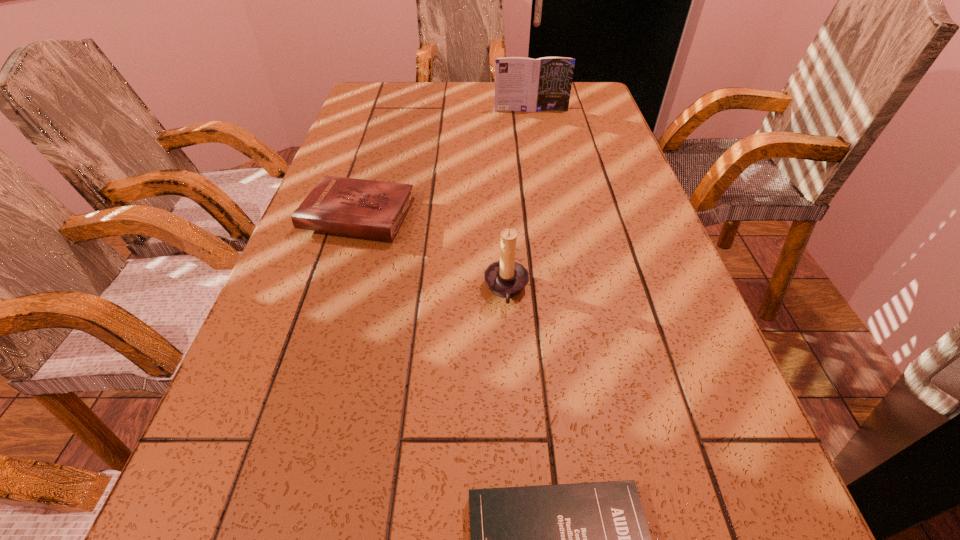
Image resolution: width=960 pixels, height=540 pixels. Identify the location of the farther book. (524, 84).

At what (x,y) coordinates should I click in order to perform the action: click on the taller book. Please return your answer as a coordinate pair (x, y). Image resolution: width=960 pixels, height=540 pixels. Looking at the image, I should click on (524, 84).

Identify the location of the second nearest object. (506, 278).

Image resolution: width=960 pixels, height=540 pixels. I want to click on the third tallest object, so click(372, 209).

In order to click on the leftmost object in this screenshot , I will do pyautogui.click(x=372, y=209).

The height and width of the screenshot is (540, 960). I want to click on free space located 0.120m on the front cover of the taller book, so click(x=535, y=131).

Where is `free point located on the wick of the candle holder`? free point located on the wick of the candle holder is located at coordinates (280, 290).

This screenshot has height=540, width=960. Find the location of `vacant area situated 0.400m on the wick of the candle holder`. vacant area situated 0.400m on the wick of the candle holder is located at coordinates (280, 290).

You are a GUI agent. You are given a task and a screenshot of the screen. Output one action in this format:
    pyautogui.click(x=<x>, y=<y>)
    Task: Click on the free space located on the wick of the candle holder
    The width and height of the screenshot is (960, 540).
    Given the screenshot: What is the action you would take?
    pyautogui.click(x=387, y=290)

I want to click on vacant area situated 0.070m on the back of the leftmost object, so click(372, 174).